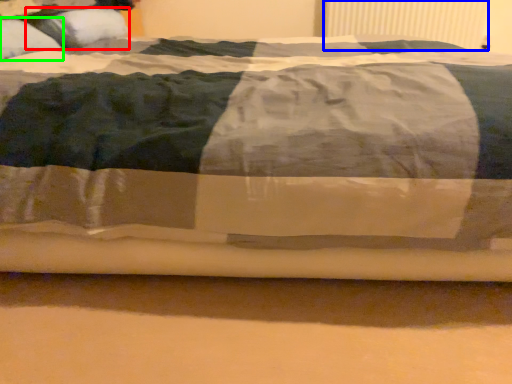
Question: Which is nearer to the pillow (highlighted by a red box)? radiator (highlighted by a blue box) or pillow (highlighted by a green box).

Choices:
 (A) radiator
 (B) pillow

Answer: (B)